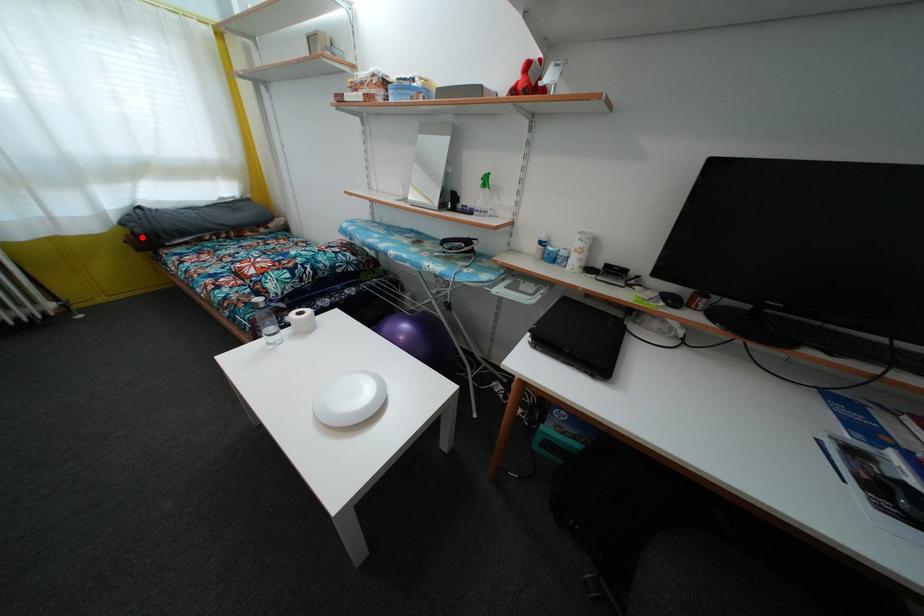
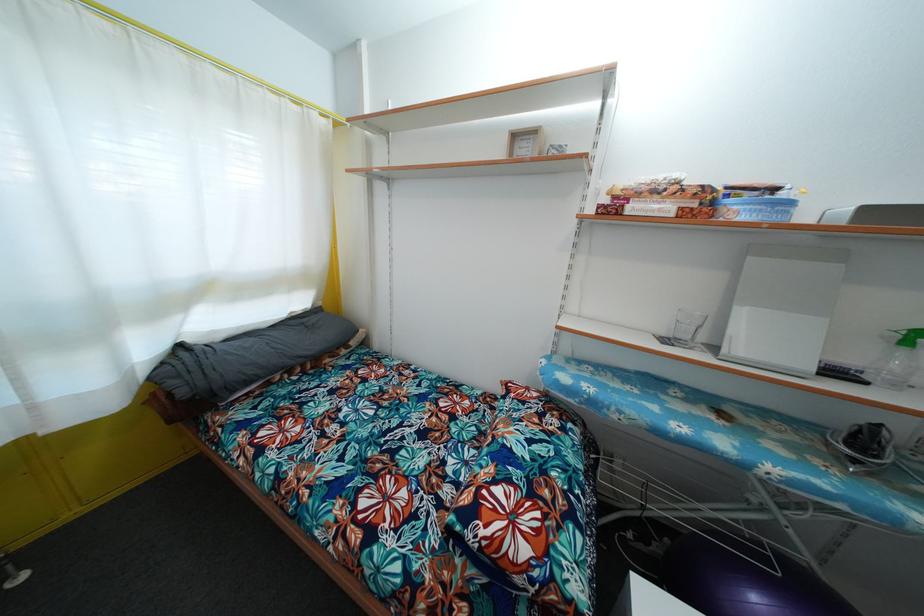
In the second image, find the point that corresponds to the highlighted location in the first image.

(187, 399)